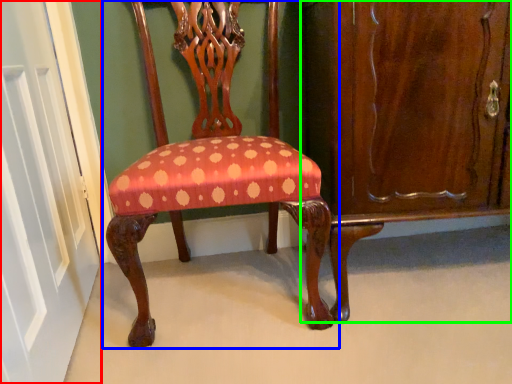
Question: Which is farther away from door (highlighted by a red box)? chair (highlighted by a blue box) or dresser (highlighted by a green box)?

Choices:
 (A) chair
 (B) dresser

Answer: (B)